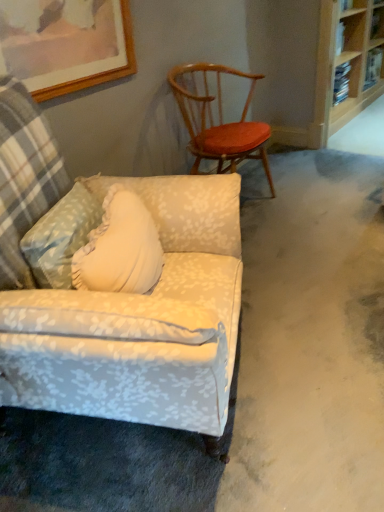
Question: From a real-world perspective, is wooden picture frame at upper left physically below wooden bookshelf at upper right?

Choices:
 (A) yes
 (B) no

Answer: (B)

Question: Is wooden picture frame at upper left far away from wooden bookshelf at upper right?

Choices:
 (A) no
 (B) yes

Answer: (B)

Question: Is wooden picture frame at upper left closer to the viewer compared to wooden bookshelf at upper right?

Choices:
 (A) yes
 (B) no

Answer: (A)

Question: Is wooden picture frame at upper left wider than wooden bookshelf at upper right?

Choices:
 (A) no
 (B) yes

Answer: (A)

Question: Considering the relative sizes of wooden picture frame at upper left and wooden bookshelf at upper right in the image provided, is wooden picture frame at upper left smaller than wooden bookshelf at upper right?

Choices:
 (A) yes
 (B) no

Answer: (A)

Question: Is wooden picture frame at upper left turned away from wooden bookshelf at upper right?

Choices:
 (A) no
 (B) yes

Answer: (A)

Question: Is floral fabric armchair at lower left, which appears as the first chair when viewed from the front, surrounding wooden spindles chair at upper right, which appears as the first chair when viewed from the back?

Choices:
 (A) yes
 (B) no

Answer: (B)

Question: Is floral fabric armchair at lower left, which appears as the first chair when viewed from the front, to the right of wooden spindles chair at upper right, which is counted as the 2th chair, starting from the front, from the viewer's perspective?

Choices:
 (A) yes
 (B) no

Answer: (B)

Question: Is floral fabric armchair at lower left, which is the 2th chair in back-to-front order, smaller than wooden spindles chair at upper right, which appears as the first chair when viewed from the back?

Choices:
 (A) no
 (B) yes

Answer: (A)

Question: Is floral fabric armchair at lower left, which appears as the first chair when viewed from the front, aimed at wooden spindles chair at upper right, which is counted as the 2th chair, starting from the front?

Choices:
 (A) no
 (B) yes

Answer: (A)

Question: Does floral fabric armchair at lower left, which is the 2th chair in back-to-front order, have a greater height compared to wooden spindles chair at upper right, which is counted as the 2th chair, starting from the front?

Choices:
 (A) yes
 (B) no

Answer: (A)

Question: From the image's perspective, is floral fabric armchair at lower left, which appears as the first chair when viewed from the front, over wooden spindles chair at upper right, which appears as the first chair when viewed from the back?

Choices:
 (A) yes
 (B) no

Answer: (B)

Question: Are floral fabric armchair at lower left, which appears as the first chair when viewed from the front, and wooden bookshelf at upper right far apart?

Choices:
 (A) no
 (B) yes

Answer: (B)